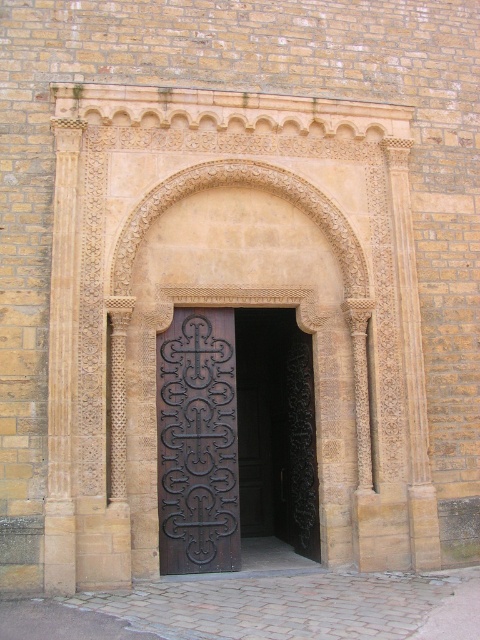
Describe the element at coordinates (233, 436) in the screenshot. This screenshot has width=480, height=640. I see `dark wood door at center` at that location.

Is point (299, 420) less distant than point (167, 346)?

No, it is not.

Locate an element on the screen. This screenshot has width=480, height=640. dark wood door at center is located at coordinates (233, 436).